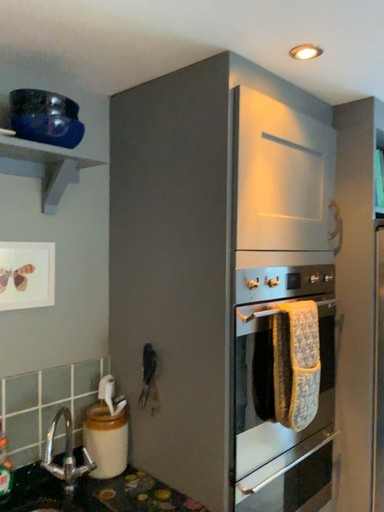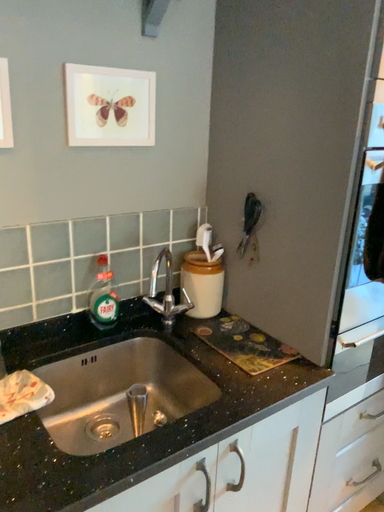
Question: How did the camera likely rotate when shooting the video?

Choices:
 (A) rotated upward
 (B) rotated downward

Answer: (B)